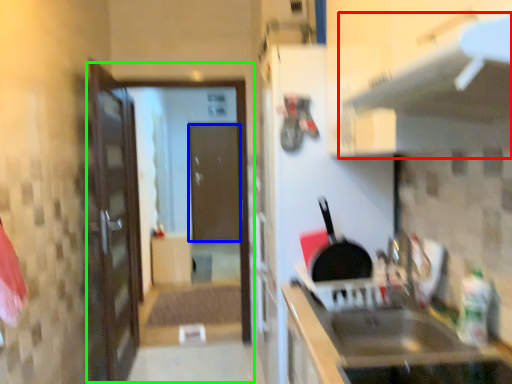
Question: Estimate the real-world distances between objects in this image. Which object is farther from exhaust hood (highlighted by a red box), door (highlighted by a blue box) or screen door (highlighted by a green box)?

Choices:
 (A) door
 (B) screen door

Answer: (A)